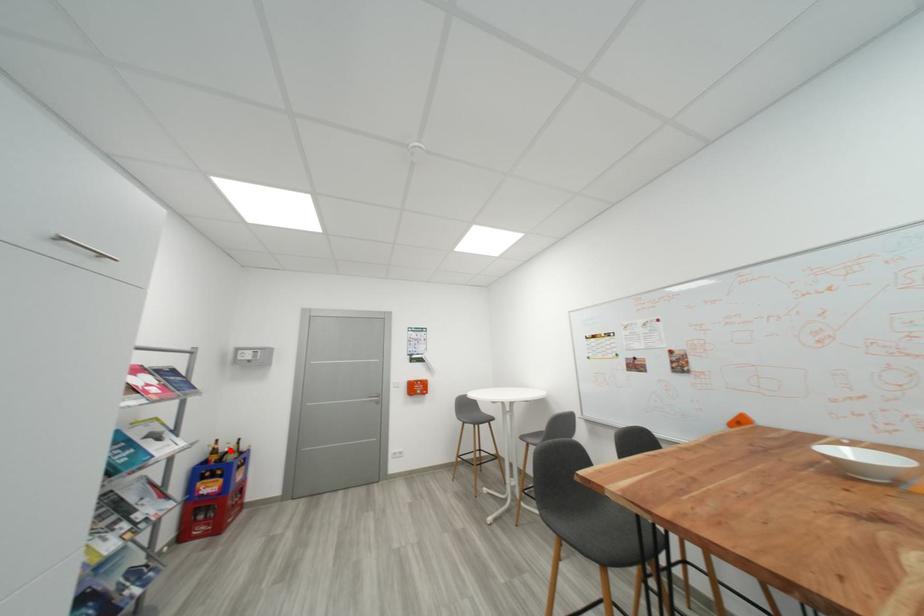
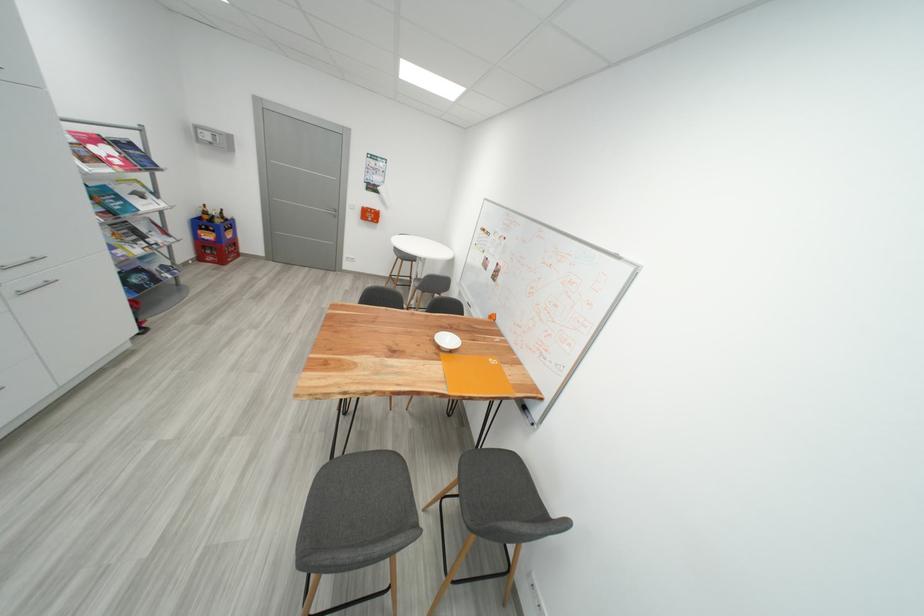
Question: I am providing you with two images of the same scene from different viewpoints. In image1, a red point is highlighted. Considering the same 3D point in image2, which of the following is correct?

Choices:
 (A) It is closer
 (B) It is farther

Answer: (A)